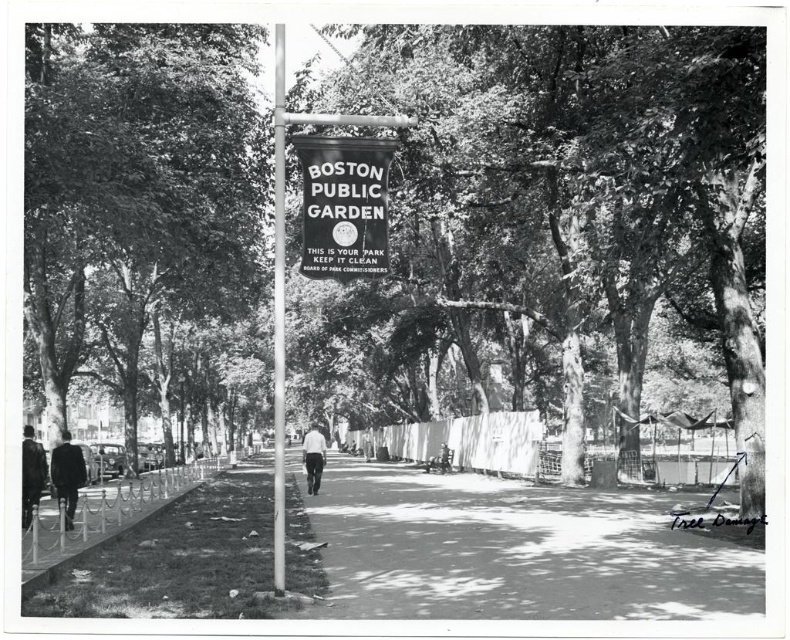
Can you confirm if smooth metal pole at center is thinner than dark wool coat at lower left?

No, smooth metal pole at center is not thinner than dark wool coat at lower left.

Is smooth metal pole at center to the left of dark wool coat at lower left from the viewer's perspective?

No, smooth metal pole at center is not to the left of dark wool coat at lower left.

From the picture: Who is more distant from viewer, (276, 467) or (66, 486)?

The point (66, 486) is behind.

At what (x,y) coordinates should I click in order to perform the action: click on smooth metal pole at center. Please return your answer as a coordinate pair (x, y). The height and width of the screenshot is (640, 790). Looking at the image, I should click on (277, 308).

Can you confirm if smooth bark tree at left is positioned to the left of dark gray jacket at left?

Correct, you'll find smooth bark tree at left to the left of dark gray jacket at left.

In the scene shown: Can you confirm if smooth bark tree at left is positioned to the right of dark gray jacket at left?

Incorrect, smooth bark tree at left is not on the right side of dark gray jacket at left.

Is point (149, 99) less distant than point (25, 433)?

No, it is behind (25, 433).

What are the coordinates of `smooth bark tree at left` in the screenshot? It's located at (134, 184).

Is smooth bark tree at center smaller than smooth metal pole at center?

Indeed, smooth bark tree at center has a smaller size compared to smooth metal pole at center.

Describe the element at coordinates (600, 186) in the screenshot. This screenshot has width=790, height=640. I see `smooth bark tree at center` at that location.

Find the location of `smooth bark tree at center`. smooth bark tree at center is located at coordinates (600, 186).